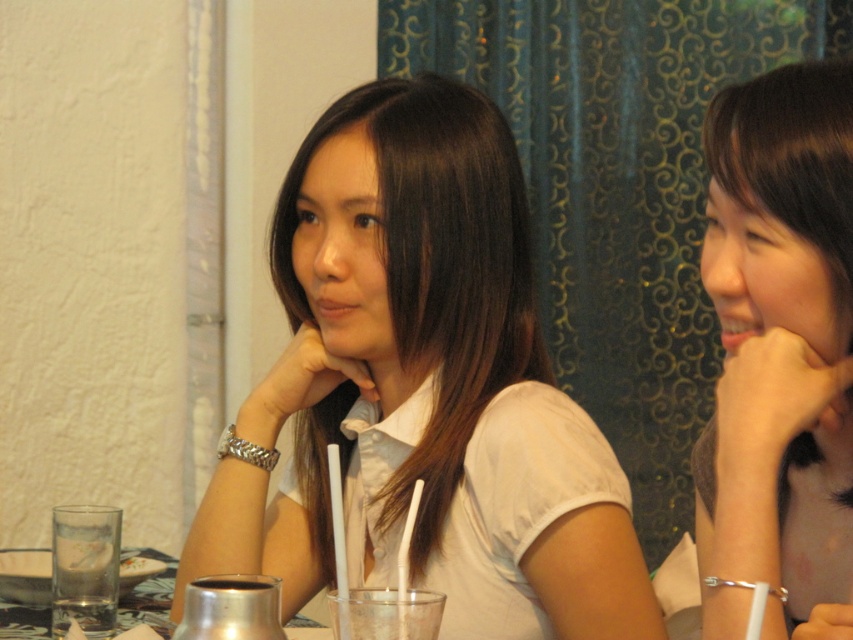
You are a fashion designer observing two people in a cafe. You notice the white matte shirt at center and the white matte shirt at upper right. Which shirt has a greater width?

The white matte shirt at center has a greater width than the white matte shirt at upper right according to the description.

You are standing in front of the table where the two people are sitting. You want to place a small item exactly at the point marked by the coordinates point (778, 358). Which object from the scene is located at this point?

The white matte shirt at upper right is located at point (778, 358).

You are a photographer standing in front of the scene. You want to take a closeup photo of the white matte shirt at center without including any other objects in the frame. Given that your camera has a minimum focusing distance of 1 meter, can you take the photo from your current position?

The white matte shirt at center and viewer are 1.06 meters apart. Since the minimum focusing distance is 1 meter, the photographer can take the photo from the current position because the distance is slightly more than the required minimum.